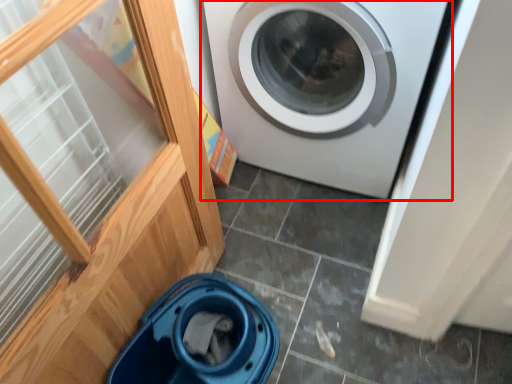
Question: From the image's perspective, what is the correct spatial relationship of washing machine (annotated by the red box) in relation to dish washer?

Choices:
 (A) below
 (B) above

Answer: (B)